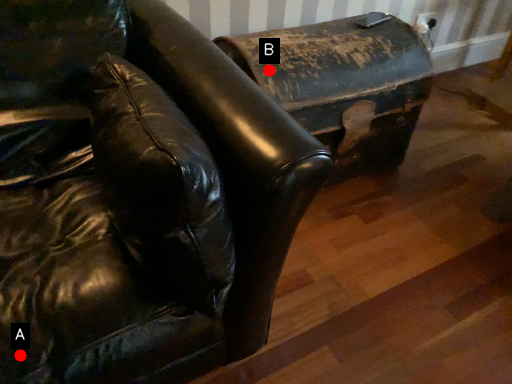
Question: Two points are circled on the image, labeled by A and B beside each circle. Which point is closer to the camera?

Choices:
 (A) A is closer
 (B) B is closer

Answer: (A)